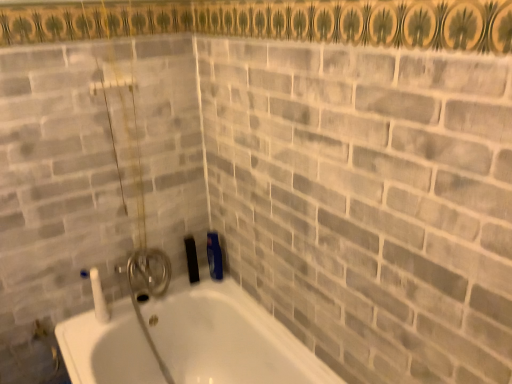
Question: Considering their positions, is white glossy bathtub at lower left located in front of or behind gray brick at upper center?

Choices:
 (A) behind
 (B) front

Answer: (A)

Question: Is white glossy bathtub at lower left inside or outside of gray brick at upper center?

Choices:
 (A) inside
 (B) outside

Answer: (B)

Question: From a real-world perspective, relative to gray brick at upper center, is white glossy bathtub at lower left vertically above or below?

Choices:
 (A) below
 (B) above

Answer: (A)

Question: Do you think gray brick at upper center is within white glossy bathtub at lower left, or outside of it?

Choices:
 (A) outside
 (B) inside

Answer: (A)

Question: In terms of size, does gray brick at upper center appear bigger or smaller than white glossy bathtub at lower left?

Choices:
 (A) big
 (B) small

Answer: (A)

Question: In terms of height, does gray brick at upper center look taller or shorter compared to white glossy bathtub at lower left?

Choices:
 (A) tall
 (B) short

Answer: (A)

Question: In the image, is gray brick at upper center positioned in front of or behind white glossy bathtub at lower left?

Choices:
 (A) behind
 (B) front

Answer: (B)